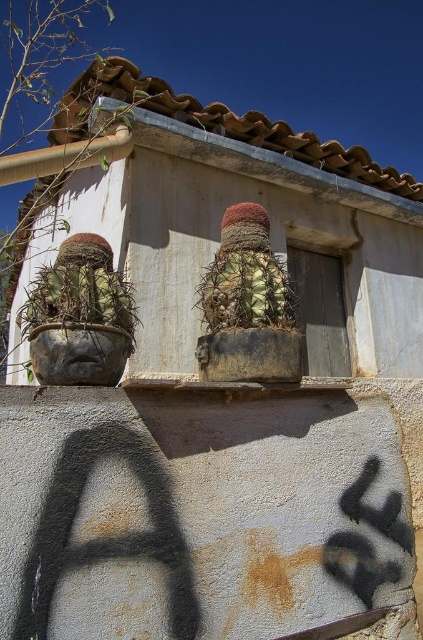
Question: Is rusty metal cactus at left smaller than green textured cactus at center?

Choices:
 (A) yes
 (B) no

Answer: (B)

Question: Which object appears closest to the camera in this image?

Choices:
 (A) green textured cactus at center
 (B) rusty metal cactus at left

Answer: (B)

Question: Observing the image, what is the correct spatial positioning of rusty metal cactus at left in reference to green textured cactus at center?

Choices:
 (A) above
 (B) below

Answer: (B)

Question: In this image, where is rusty metal cactus at left located relative to green textured cactus at center?

Choices:
 (A) below
 (B) above

Answer: (A)

Question: Which of the following is the farthest from the observer?

Choices:
 (A) rusty metal cactus at left
 (B) green textured cactus at center

Answer: (B)